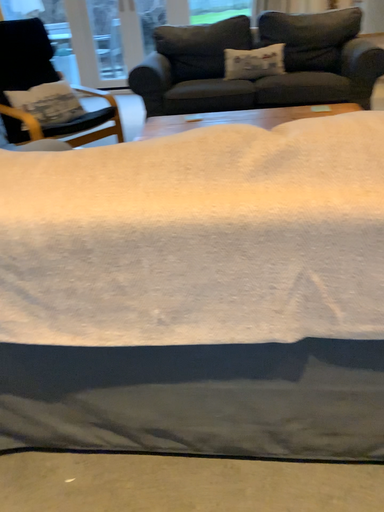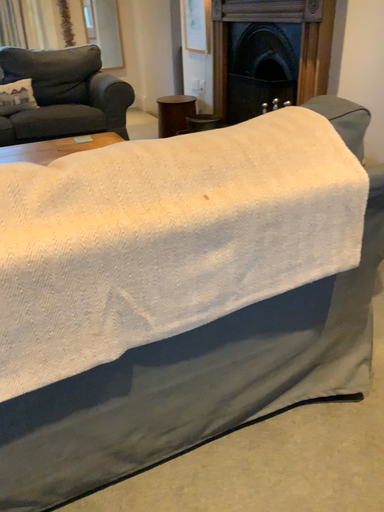
Question: How did the camera likely rotate when shooting the video?

Choices:
 (A) rotated left
 (B) rotated right

Answer: (B)